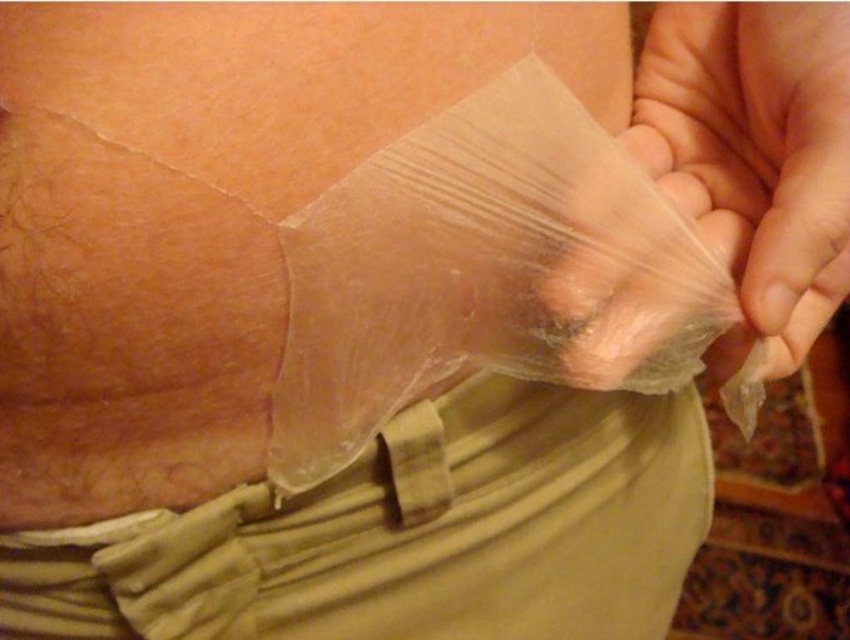
Question: From the image, what is the correct spatial relationship of transparent plastic at lower center in relation to transparent plastic bag at lower right?

Choices:
 (A) left
 (B) right

Answer: (A)

Question: Can you confirm if transparent plastic at lower center is smaller than transparent plastic bag at lower right?

Choices:
 (A) yes
 (B) no

Answer: (B)

Question: From the image, what is the correct spatial relationship of transparent plastic at lower center in relation to transparent plastic bag at lower right?

Choices:
 (A) left
 (B) right

Answer: (A)